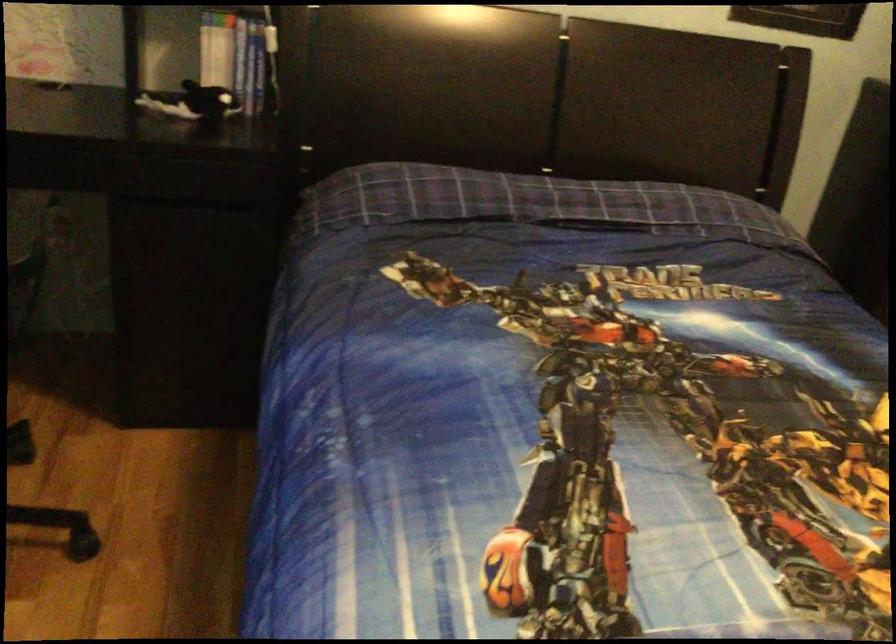
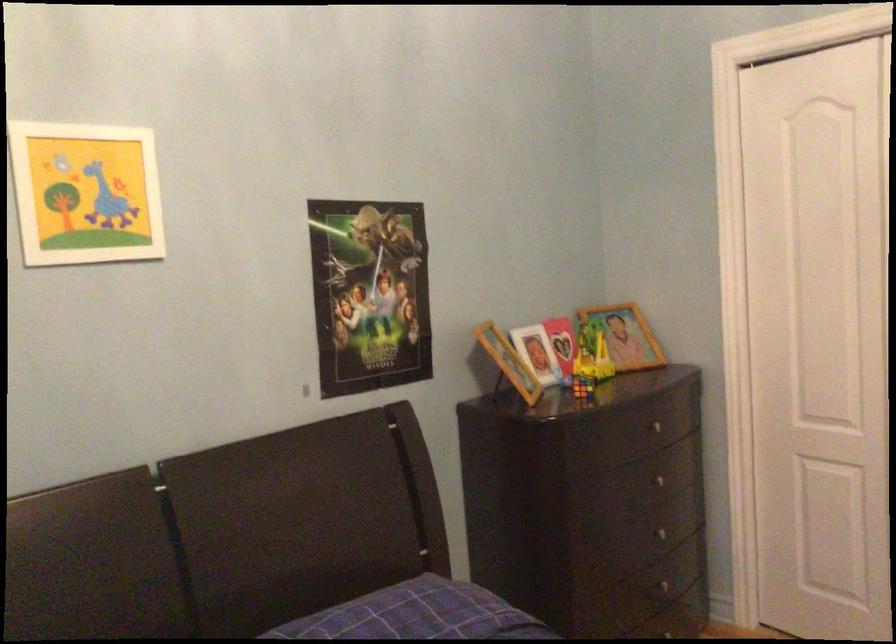
Question: The first image is from the beginning of the video and the second image is from the end. How did the camera likely rotate when shooting the video?

Choices:
 (A) Left
 (B) Right
 (C) Up
 (D) Down

Answer: (B)